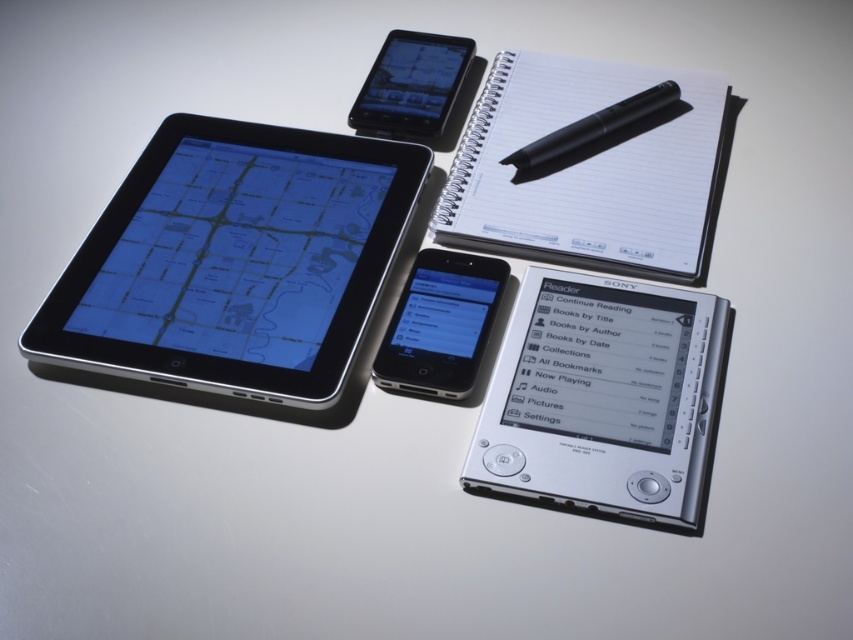
How far apart are silver metallic e-reader at center and black matte pen at upper center?

silver metallic e-reader at center and black matte pen at upper center are 33.82 centimeters apart.

Is silver metallic e-reader at center wider than black matte pen at upper center?

Correct, the width of silver metallic e-reader at center exceeds that of black matte pen at upper center.

Which is in front, point (602, 472) or point (624, 106)?

Positioned in front is point (602, 472).

At what (x,y) coordinates should I click in order to perform the action: click on silver metallic e-reader at center. Please return your answer as a coordinate pair (x, y). Looking at the image, I should click on (602, 397).

Does silver metallic e-reader at center appear under matte black tablet at upper center?

Yes.

Is silver metallic e-reader at center closer to camera compared to matte black tablet at upper center?

That is True.

The image size is (853, 640). Describe the element at coordinates (602, 397) in the screenshot. I see `silver metallic e-reader at center` at that location.

Where is `silver metallic e-reader at center`? silver metallic e-reader at center is located at coordinates (602, 397).

Who is higher up, silver metallic tablet at center-left or matte black tablet at upper center?

matte black tablet at upper center is higher up.

Which is more to the right, silver metallic tablet at center-left or matte black tablet at upper center?

matte black tablet at upper center

Where is `silver metallic tablet at center-left`? silver metallic tablet at center-left is located at coordinates (235, 260).